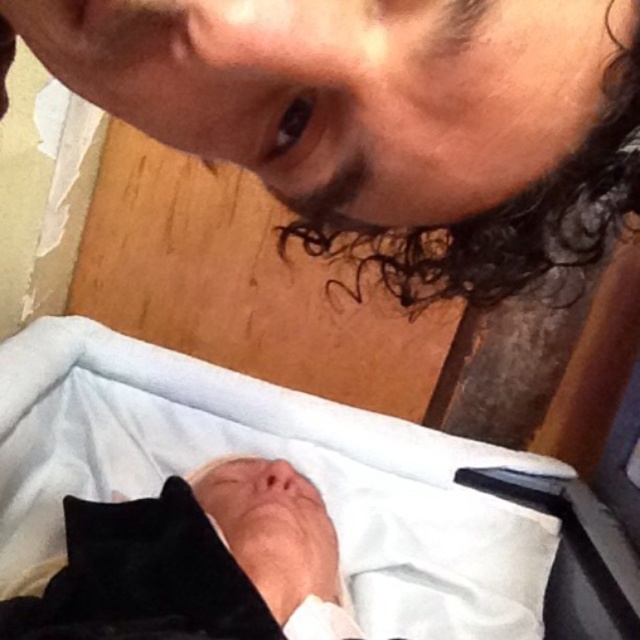
You are a photographer trying to capture a close up of both the black velvet newborn at lower center and the curly dark brown hair at upper center. Since the camera can only focus on one subject at a time, which subject should you choose to ensure the other is still in the frame?

The black velvet newborn at lower center is positioned on the left side of curly dark brown hair at upper center. To ensure both are in the frame, focus on the subject that is closer to the center. However, since the question specifies focusing on one while keeping the other in frame, you can choose either, but the positioning suggests they are side by side. However, the answer might need to clarify based on spatial arrangement. Wait, according to the object description, the newborn is on the left of thecur

You are a photographer setting up for a family portrait. You have to ensure the white fabric infant bed at lower center and the black velvet newborn at lower center are positioned correctly. Based on the scene description, which object is placed higher in the image?

The white fabric infant bed at lower center is located above the black velvet newborn at lower center, so it is placed higher in the image.

You are a photographer trying to capture a close shot of the curly dark brown hair at upper center and the white fabric infant bed at lower center. The camera you are using has a minimum focusing distance of 12 inches. Can you take a clear photo of both objects without moving the camera?

The distance between the curly dark brown hair at upper center and the white fabric infant bed at lower center is 13.87 inches. Since the camera requires at least 12 inches to focus, the camera can capture both objects clearly as the distance is sufficient.